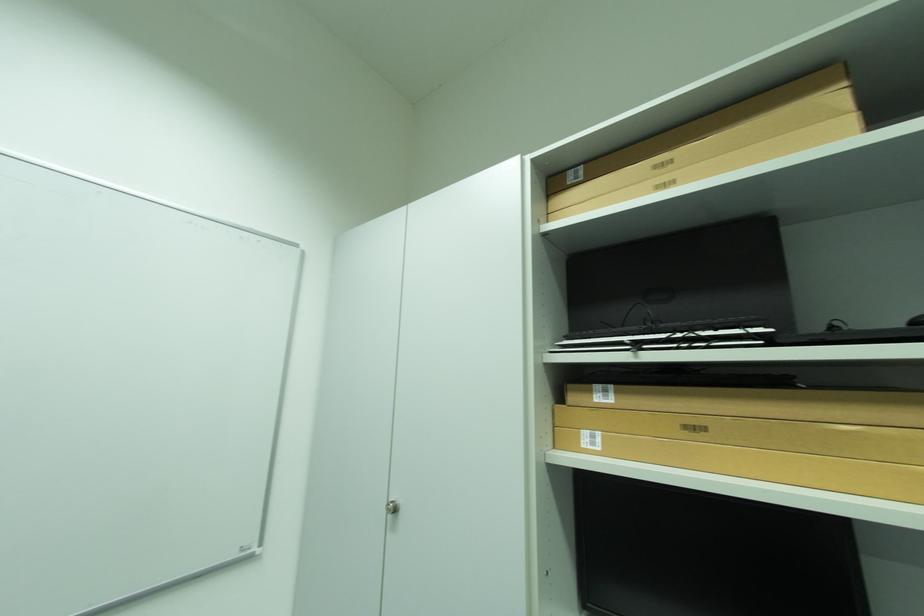
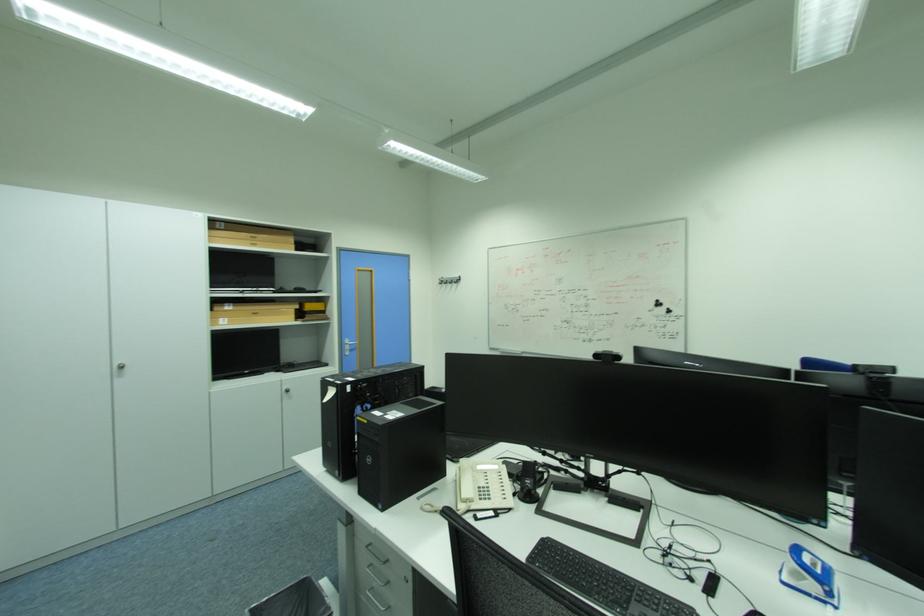
In the second image, find the point that corresponds to (402,527) in the first image.

(128, 376)